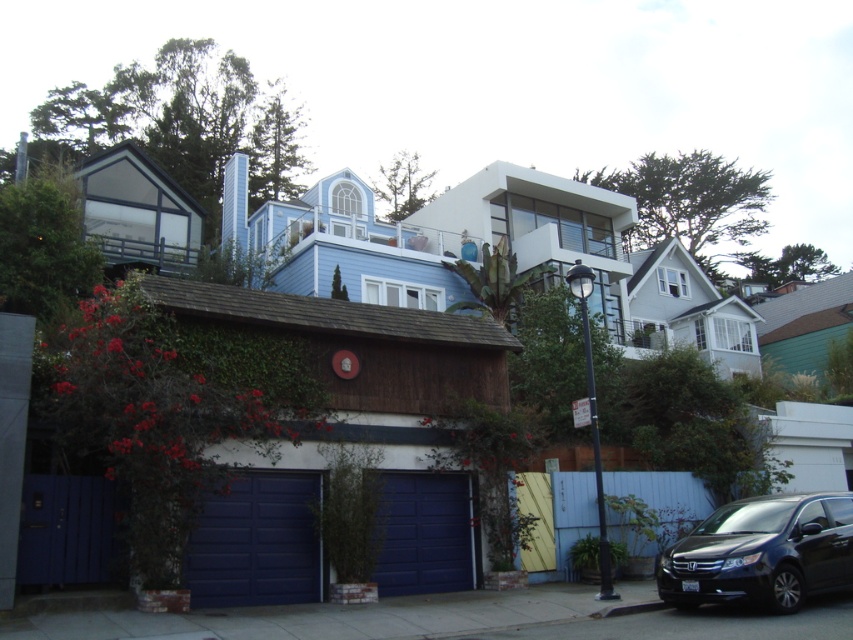
Question: Which point appears closest to the camera in this image?

Choices:
 (A) (257, 563)
 (B) (810, 513)
 (C) (413, 504)

Answer: (B)

Question: Among these objects, which one is nearest to the camera?

Choices:
 (A) black glossy minivan at lower right
 (B) blue smooth garage door at lower left
 (C) blue matte/glossy garage door at center

Answer: (A)

Question: Among these points, which one is nearest to the camera?

Choices:
 (A) (682, 556)
 (B) (444, 518)
 (C) (225, 577)

Answer: (A)

Question: Is black glossy minivan at lower right behind blue matte/glossy garage door at center?

Choices:
 (A) yes
 (B) no

Answer: (B)

Question: Can you confirm if black glossy minivan at lower right is thinner than blue matte/glossy garage door at center?

Choices:
 (A) no
 (B) yes

Answer: (A)

Question: Where is black glossy minivan at lower right located in relation to blue smooth garage door at lower left in the image?

Choices:
 (A) below
 (B) above

Answer: (B)